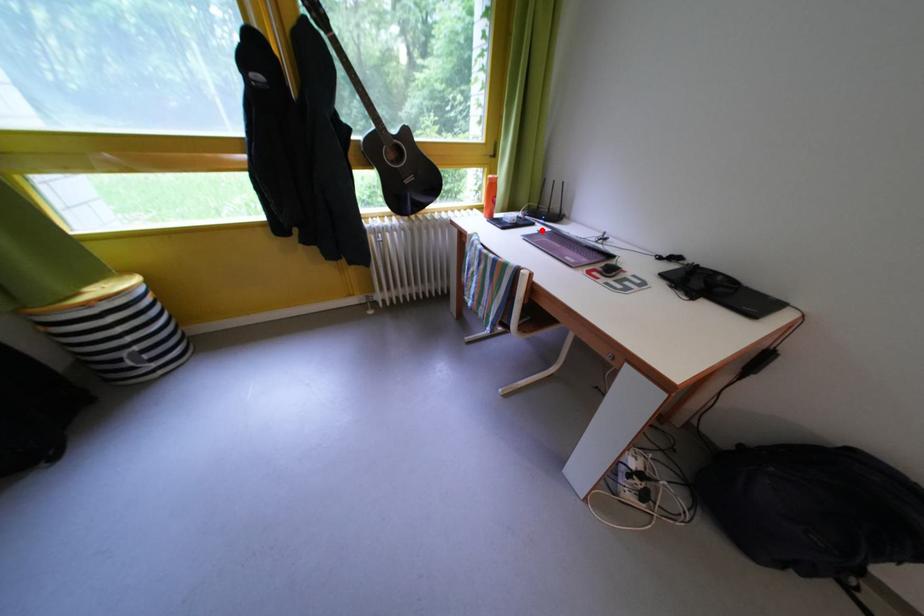
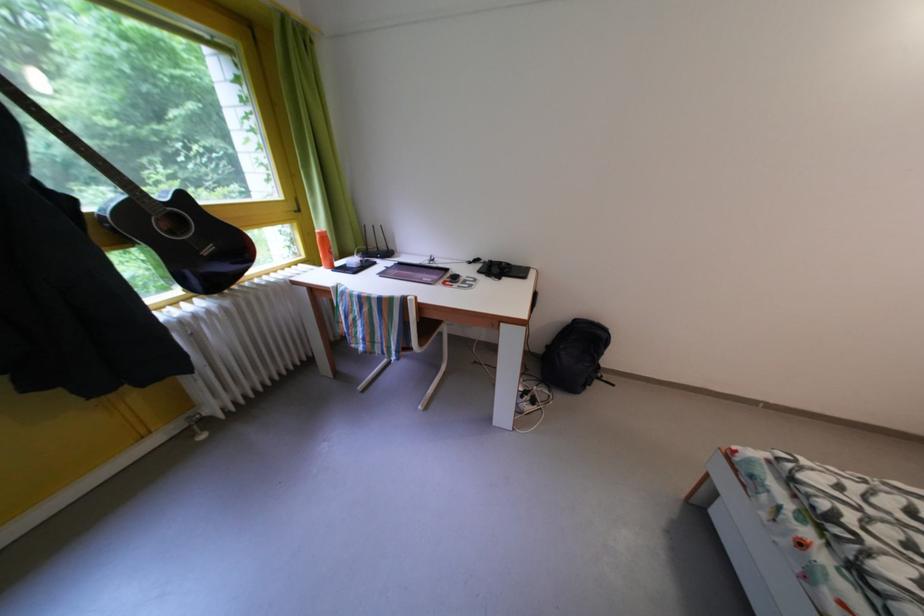
Where in the second image is the point corresponding to the highlighted location from the first image?

(383, 270)